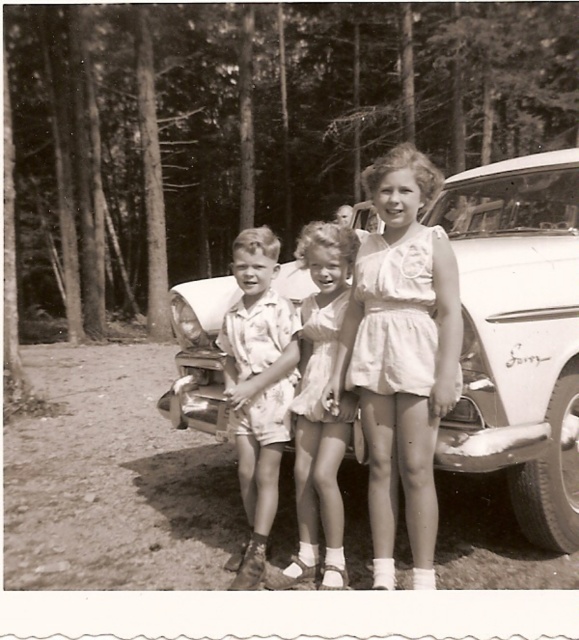
Does white glossy car at center have a lesser width compared to floral fabric shorts at center?

No.

Does white glossy car at center have a greater height compared to floral fabric shorts at center?

Yes.

Between point (529, 305) and point (288, 353), which one is positioned behind?

Point (288, 353)

This screenshot has width=579, height=640. What are the coordinates of `white glossy car at center` in the screenshot? It's located at (518, 336).

Does point (390, 438) come farther from viewer compared to point (325, 275)?

That is False.

Does point (350, 378) come farther from viewer compared to point (332, 468)?

That is False.

Locate an element on the screen. white cotton dress at center is located at coordinates (401, 355).

Can you confirm if white cotton dress at center is wider than floral fabric shorts at center?

Correct, the width of white cotton dress at center exceeds that of floral fabric shorts at center.

Between white cotton dress at center and floral fabric shorts at center, which one has less height?

floral fabric shorts at center is shorter.

Which is in front, point (400, 253) or point (265, 266)?

Point (400, 253) is in front.

Locate an element on the screen. The width and height of the screenshot is (579, 640). white cotton dress at center is located at coordinates (401, 355).